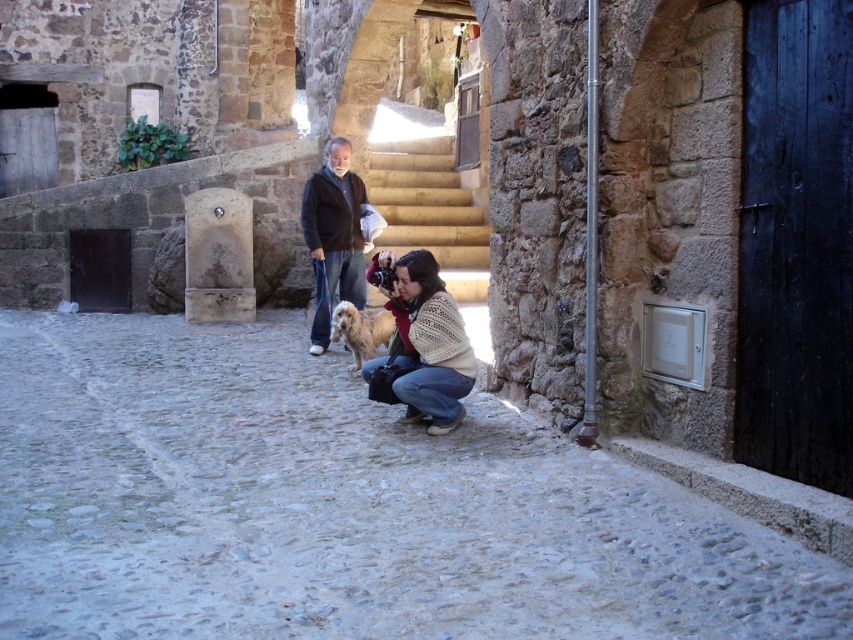
In the scene shown: You are planning to take a photo of the golden fur dog at center and the yellow stone stairs at center in the historic courtyard. Which object should you focus on first if you want to capture both clearly in your shot?

The yellow stone stairs at center is larger in size than the golden fur dog at center, so you should focus on the larger object first to ensure both are in clear view.

You are standing in the historic stone courtyard and want to take a photo of the smooth stone alley at center. The dark brown jacket at center is blocking your view. Can you move around to get a clear shot without the jacket in the frame?

The smooth stone alley at center is closer to the viewer than the dark brown jacket at center, so you can move to the side to position yourself where the alley is visible without the jacket blocking the view.

You are a tourist in this historic courtyard and want to take a photo of both the white knitted sweater at center and the dark brown jacket at center. Which one should you focus on first to ensure both are in sharp focus?

You should focus on the white knitted sweater at center first because it is closer to the viewer than the dark brown jacket at center, so adjusting focus from near to far will help both be in sharp focus.